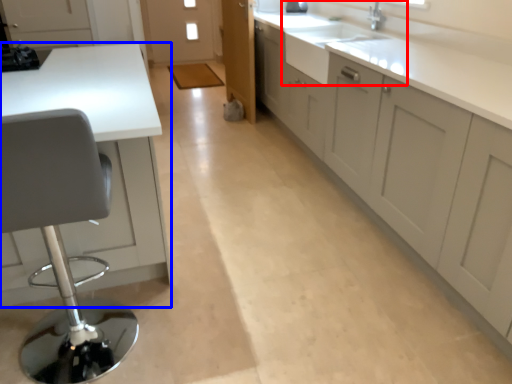
Question: Which of the following is the farthest to the observer, sink (highlighted by a red box) or countertop (highlighted by a blue box)?

Choices:
 (A) sink
 (B) countertop

Answer: (A)